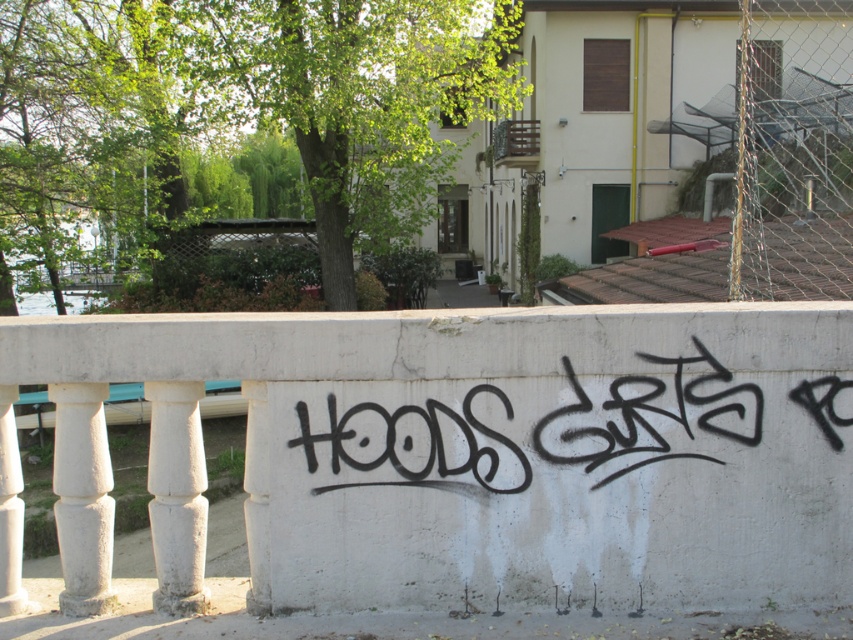
You are a photographer trying to capture the white concrete fence at center and the black graffiti at center in a single shot. Based on their sizes, which object should you focus on to ensure both are clearly visible in the frame?

Since the white concrete fence at center is larger in size than the black graffiti at center, you should focus on the white concrete fence at center to ensure both objects fit clearly within the frame.

You are standing at point A located at coordinates point A at (270, 353). You want to walk to point B, which is 4.39 meters away from you. Can you estimate how many steps it would take you to reach point B if your average step length is 0.75 meters?

The distance between point A at (270, 353) and point B is 4.39 meters. With an average step length of 0.75 meters, you would need approximately 6 steps to cover the distance, since 4.39 divided by 0.75 is approximately 5.85, which rounds up to 6 steps.

You are standing in front of the concrete railing with graffiti. There are two points marked on the railing at coordinates point (x=97, y=342) and point (x=468, y=435). If you want to touch both points starting from the nearest one, which point should you reach for first?

You should reach for point (x=97, y=342) first because it is closer to you than point (x=468, y=435).